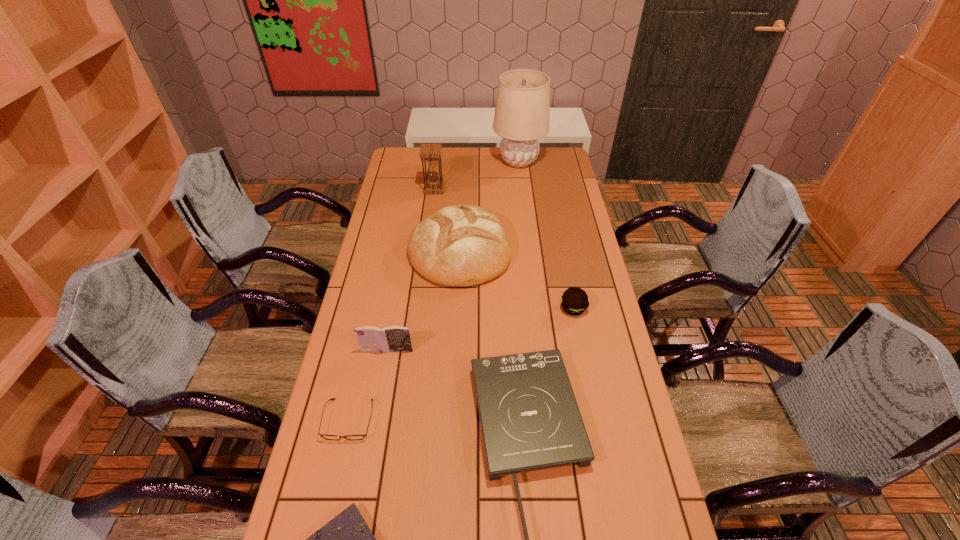
At what (x,y) coordinates should I click in order to perform the action: click on vacant area that lies between the spectacles and the book. Please return your answer as a coordinate pair (x, y). This screenshot has width=960, height=540. Looking at the image, I should click on (368, 385).

Locate which object is the seventh closest to the patty. Please provide its 2D coordinates. Your answer should be formatted as a tuple, i.e. [(x, y)], where the tuple contains the x and y coordinates of a point satisfying the conditions above.

[(522, 114)]

Point out which object is positioned as the fourth nearest to the farthest object. Please provide its 2D coordinates. Your answer should be formatted as a tuple, i.e. [(x, y)], where the tuple contains the x and y coordinates of a point satisfying the conditions above.

[(393, 338)]

Image resolution: width=960 pixels, height=540 pixels. I want to click on blank area in the image that satisfies the following two spatial constraints: 1. on the front side of the lampshade; 2. on the left side of the fourth shortest object, so click(537, 308).

You are a GUI agent. You are given a task and a screenshot of the screen. Output one action in this format:
    pyautogui.click(x=<x>, y=<y>)
    Task: Click on the vacant area in the image that satisfies the following two spatial constraints: 1. on the front side of the fourth shortest object; 2. on the right side of the third farthest object
    The height and width of the screenshot is (540, 960).
    Given the screenshot: What is the action you would take?
    pyautogui.click(x=457, y=308)